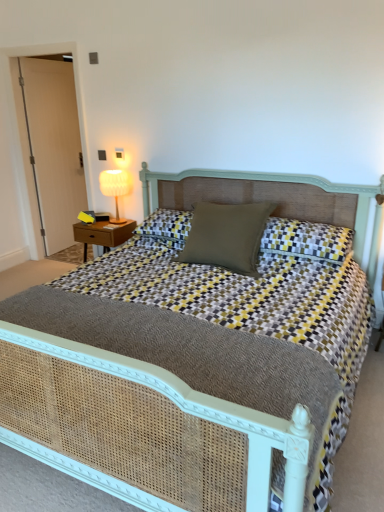
Question: Can you confirm if white wood door at left is positioned to the right of woven cane bed at center?

Choices:
 (A) yes
 (B) no

Answer: (B)

Question: Is white wood door at left at the left side of woven cane bed at center?

Choices:
 (A) yes
 (B) no

Answer: (A)

Question: Can you confirm if white wood door at left is smaller than woven cane bed at center?

Choices:
 (A) no
 (B) yes

Answer: (B)

Question: Is white wood door at left closer to camera compared to woven cane bed at center?

Choices:
 (A) no
 (B) yes

Answer: (A)

Question: Does white wood door at left have a greater width compared to woven cane bed at center?

Choices:
 (A) no
 (B) yes

Answer: (A)

Question: From a real-world perspective, is white wood door at left under woven cane bed at center?

Choices:
 (A) no
 (B) yes

Answer: (A)

Question: Does yellow-and-gray checkered pillow at center, the 2th pillow when ordered from left to right, have a smaller size compared to wooden nightstand at left?

Choices:
 (A) no
 (B) yes

Answer: (A)

Question: Is the position of yellow-and-gray checkered pillow at center, the 2th pillow when ordered from left to right, more distant than that of wooden nightstand at left?

Choices:
 (A) yes
 (B) no

Answer: (B)

Question: From the image's perspective, is yellow-and-gray checkered pillow at center, the 2th pillow when ordered from left to right, on top of wooden nightstand at left?

Choices:
 (A) yes
 (B) no

Answer: (A)

Question: Considering the relative sizes of yellow-and-gray checkered pillow at center, the 2th pillow when ordered from left to right, and wooden nightstand at left in the image provided, is yellow-and-gray checkered pillow at center, the 2th pillow when ordered from left to right, taller than wooden nightstand at left?

Choices:
 (A) no
 (B) yes

Answer: (A)

Question: Is yellow-and-gray checkered pillow at center, the first pillow viewed from the right, outside of wooden nightstand at left?

Choices:
 (A) no
 (B) yes

Answer: (B)

Question: Considering the relative sizes of yellow-and-gray checkered pillow at center, the 2th pillow when ordered from left to right, and wooden nightstand at left in the image provided, is yellow-and-gray checkered pillow at center, the 2th pillow when ordered from left to right, shorter than wooden nightstand at left?

Choices:
 (A) yes
 (B) no

Answer: (A)

Question: Can you confirm if yellow-and-gray checkered pillow at center, the first pillow viewed from the right, is wider than woven cane bed at center?

Choices:
 (A) no
 (B) yes

Answer: (A)